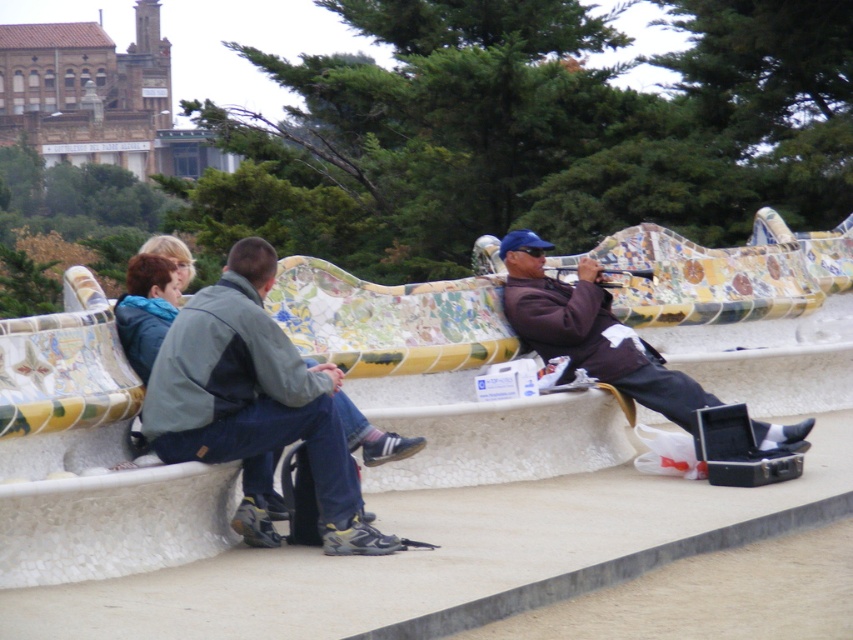
Question: Which point is closer to the camera?

Choices:
 (A) gray fabric jacket at center
 (B) matte gray jacket at center
 (C) matte brown jacket at center

Answer: (B)

Question: Can you confirm if gray fabric jacket at center is thinner than matte brown jacket at center?

Choices:
 (A) no
 (B) yes

Answer: (B)

Question: Considering the relative positions of gray fabric jacket at center and matte brown jacket at center in the image provided, where is gray fabric jacket at center located with respect to matte brown jacket at center?

Choices:
 (A) below
 (B) above

Answer: (A)

Question: Which of the following is the closest to the observer?

Choices:
 (A) pyautogui.click(x=444, y=330)
 (B) pyautogui.click(x=277, y=353)

Answer: (B)

Question: Is matte gray jacket at center to the left of matte brown jacket at center from the viewer's perspective?

Choices:
 (A) no
 (B) yes

Answer: (B)

Question: Which is nearer to the matte gray jacket at center?

Choices:
 (A) matte brown jacket at center
 (B) gray fabric jacket at center

Answer: (A)